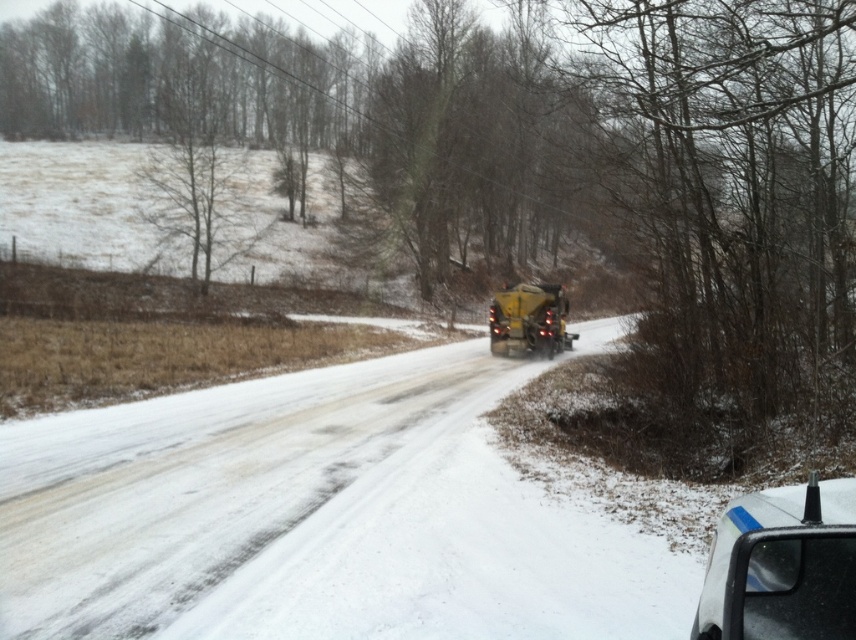
Question: Which of the following is the farthest from the observer?

Choices:
 (A) (498, 292)
 (B) (783, 618)

Answer: (A)

Question: Is black glossy car at lower right thinner than yellow matte plow at center?

Choices:
 (A) yes
 (B) no

Answer: (A)

Question: Which point is closer to the camera?

Choices:
 (A) black glossy car at lower right
 (B) yellow matte plow at center

Answer: (A)

Question: Is black glossy car at lower right wider than yellow matte plow at center?

Choices:
 (A) yes
 (B) no

Answer: (B)

Question: Which point appears closest to the camera in this image?

Choices:
 (A) (498, 305)
 (B) (750, 595)

Answer: (B)

Question: Where is black glossy car at lower right located in relation to yellow matte plow at center in the image?

Choices:
 (A) left
 (B) right

Answer: (A)